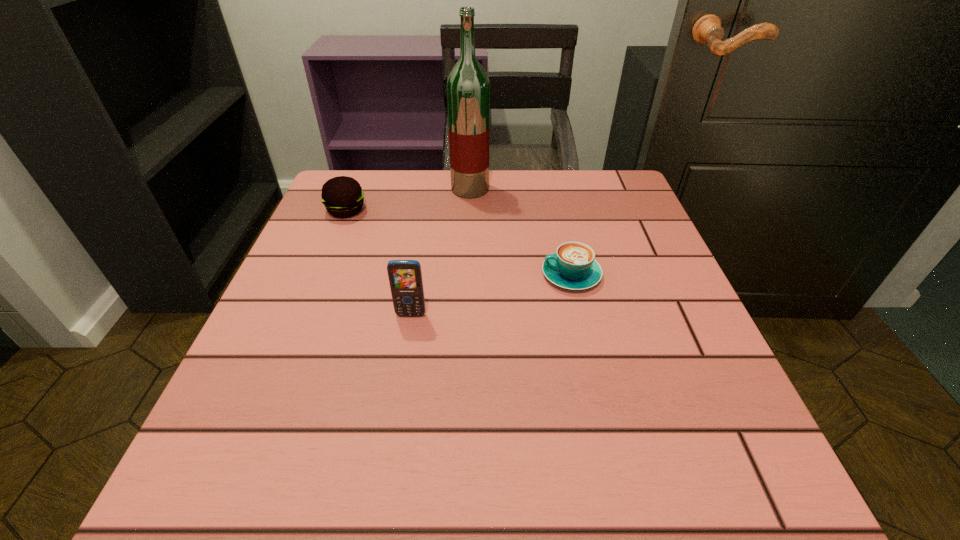
Identify the location of vacant space situated on the right of the second farthest object. Image resolution: width=960 pixels, height=540 pixels. (442, 211).

Locate an element on the screen. The height and width of the screenshot is (540, 960). free location located with the handle on the right side of the cappuccino is located at coordinates (458, 275).

Find the location of a particular element. This screenshot has width=960, height=540. free space located 0.210m with the handle on the right side of the cappuccino is located at coordinates (431, 275).

The width and height of the screenshot is (960, 540). Find the location of `blank area located 0.140m with the handle on the right side of the cappuccino`. blank area located 0.140m with the handle on the right side of the cappuccino is located at coordinates (468, 275).

Identify the location of liquor at the far edge. This screenshot has height=540, width=960. (468, 87).

At what (x,y) coordinates should I click in order to perform the action: click on patty that is at the far edge. Please return your answer as a coordinate pair (x, y). This screenshot has width=960, height=540. Looking at the image, I should click on (343, 197).

Where is `object located in the left edge section of the desktop`? object located in the left edge section of the desktop is located at coordinates (343, 197).

At what (x,y) coordinates should I click in order to perform the action: click on object at the right edge. Please return your answer as a coordinate pair (x, y). Looking at the image, I should click on (573, 266).

Where is `object present at the far left corner`? object present at the far left corner is located at coordinates (343, 197).

Locate an element on the screen. The height and width of the screenshot is (540, 960). vacant space at the far edge of the desktop is located at coordinates (563, 189).